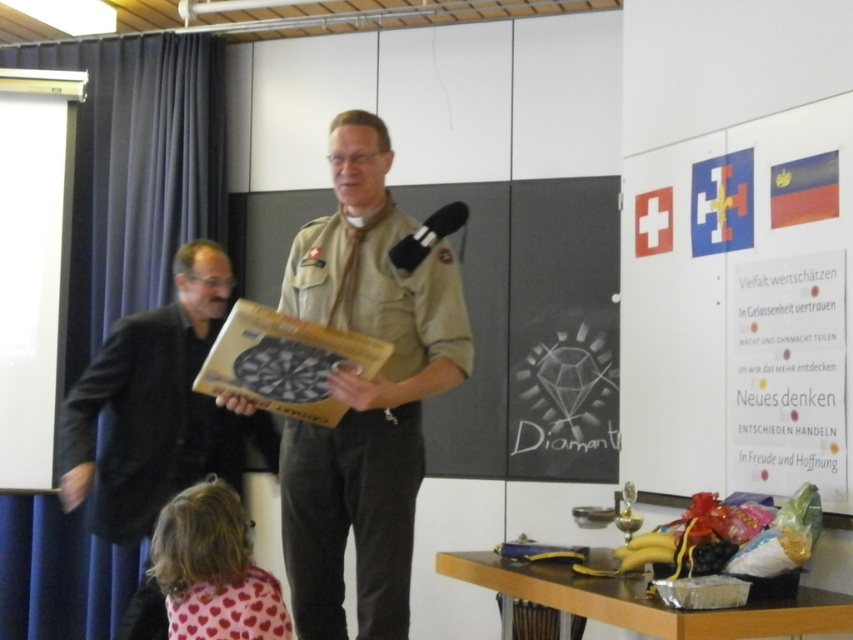
You are standing in the classroom and want to place a 2.0 meter long banner horizontally on the wall behind the matte cardboard dartboard at center. Is there enough space between the dartboard and the wall to hang the banner?

The distance between the matte cardboard dartboard at center and the viewer is 2.15 meters, so there is sufficient space to hang a 2.0 meter long banner horizontally behind it.